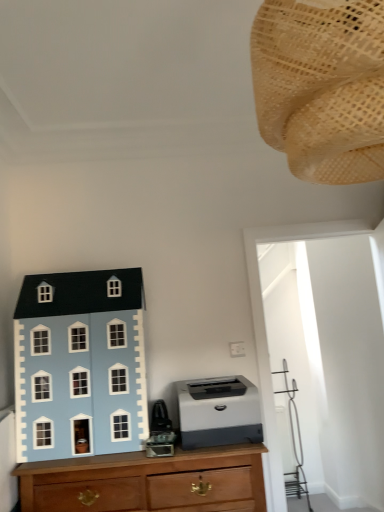
Question: Can you confirm if light blue matte dollhouse at left, marked as the 2th toy in a front-to-back arrangement, is positioned to the left of wooden chest of drawers at lower left?

Choices:
 (A) no
 (B) yes

Answer: (B)

Question: Is light blue matte dollhouse at left, acting as the 1th toy starting from the left, located outside wooden chest of drawers at lower left?

Choices:
 (A) yes
 (B) no

Answer: (A)

Question: Does light blue matte dollhouse at left, placed as the first toy when sorted from bottom to top, have a smaller size compared to wooden chest of drawers at lower left?

Choices:
 (A) yes
 (B) no

Answer: (A)

Question: Is light blue matte dollhouse at left, which appears as the second toy when viewed from the top, directly adjacent to wooden chest of drawers at lower left?

Choices:
 (A) yes
 (B) no

Answer: (B)

Question: Is light blue matte dollhouse at left, the first toy when ordered from back to front, further to the viewer compared to wooden chest of drawers at lower left?

Choices:
 (A) yes
 (B) no

Answer: (A)

Question: In the image, is woven beige lampshade at upper right, which appears as the second toy when ordered from the bottom, positioned in front of or behind light blue matte dollhouse at left, acting as the 1th toy starting from the left?

Choices:
 (A) behind
 (B) front

Answer: (B)

Question: Looking at the image, does woven beige lampshade at upper right, the second toy positioned from the back, seem bigger or smaller compared to light blue matte dollhouse at left, which appears as the second toy when viewed from the top?

Choices:
 (A) small
 (B) big

Answer: (A)

Question: From the image's perspective, relative to light blue matte dollhouse at left, placed as the first toy when sorted from bottom to top, is woven beige lampshade at upper right, the second toy positioned from the back, above or below?

Choices:
 (A) below
 (B) above

Answer: (B)

Question: Would you say woven beige lampshade at upper right, the second toy positioned from the back, is inside or outside light blue matte dollhouse at left, acting as the 1th toy starting from the left?

Choices:
 (A) inside
 (B) outside

Answer: (B)

Question: Is gray matte printer at center in front of or behind light blue matte dollhouse at left, placed as the first toy when sorted from bottom to top, in the image?

Choices:
 (A) behind
 (B) front

Answer: (A)

Question: Is gray matte printer at center to the left or to the right of light blue matte dollhouse at left, which appears as the second toy when viewed from the top, in the image?

Choices:
 (A) left
 (B) right

Answer: (B)

Question: From the image's perspective, is gray matte printer at center above or below light blue matte dollhouse at left, marked as the 2th toy in a front-to-back arrangement?

Choices:
 (A) below
 (B) above

Answer: (A)

Question: Considering the positions of gray matte printer at center and light blue matte dollhouse at left, the second toy when ordered from right to left, in the image, is gray matte printer at center wider or thinner than light blue matte dollhouse at left, the second toy when ordered from right to left,?

Choices:
 (A) thin
 (B) wide

Answer: (B)

Question: Is light blue matte dollhouse at left, acting as the 1th toy starting from the left, taller or shorter than wooden chest of drawers at lower left?

Choices:
 (A) short
 (B) tall

Answer: (B)

Question: From the image's perspective, is light blue matte dollhouse at left, the first toy when ordered from back to front, above or below wooden chest of drawers at lower left?

Choices:
 (A) above
 (B) below

Answer: (A)